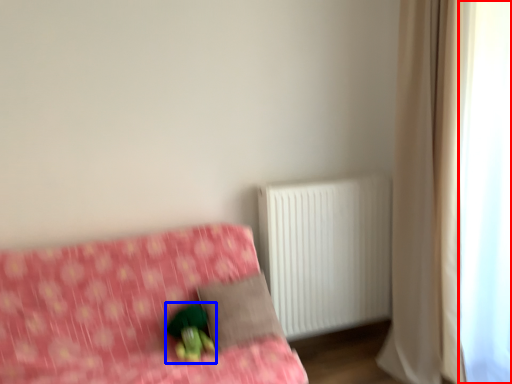
Question: Among these objects, which one is farthest to the camera, window screen (highlighted by a red box) or figurine (highlighted by a blue box)?

Choices:
 (A) window screen
 (B) figurine

Answer: (B)